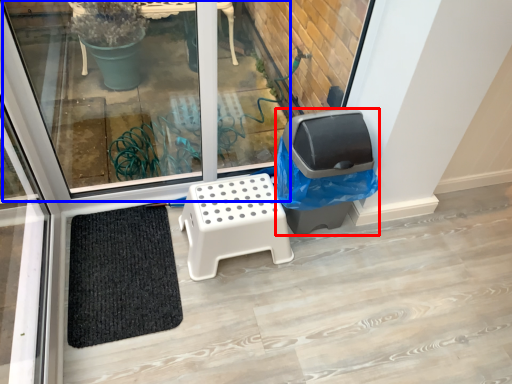
Question: Which object is closer to the camera taking this photo, garbage (highlighted by a red box) or window (highlighted by a blue box)?

Choices:
 (A) garbage
 (B) window

Answer: (B)